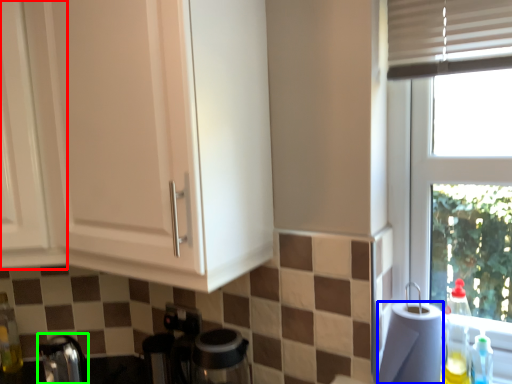
Question: Which object is the closest to the cabinetry (highlighted by a red box)? Choose among these: paper towel (highlighted by a blue box) or faucet (highlighted by a green box).

Choices:
 (A) paper towel
 (B) faucet

Answer: (B)